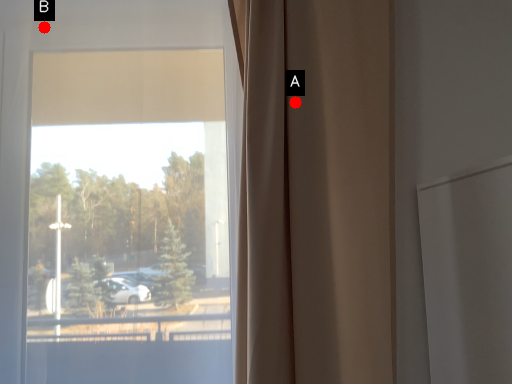
Question: Two points are circled on the image, labeled by A and B beside each circle. Which point is farther to the camera?

Choices:
 (A) A is further
 (B) B is further

Answer: (B)